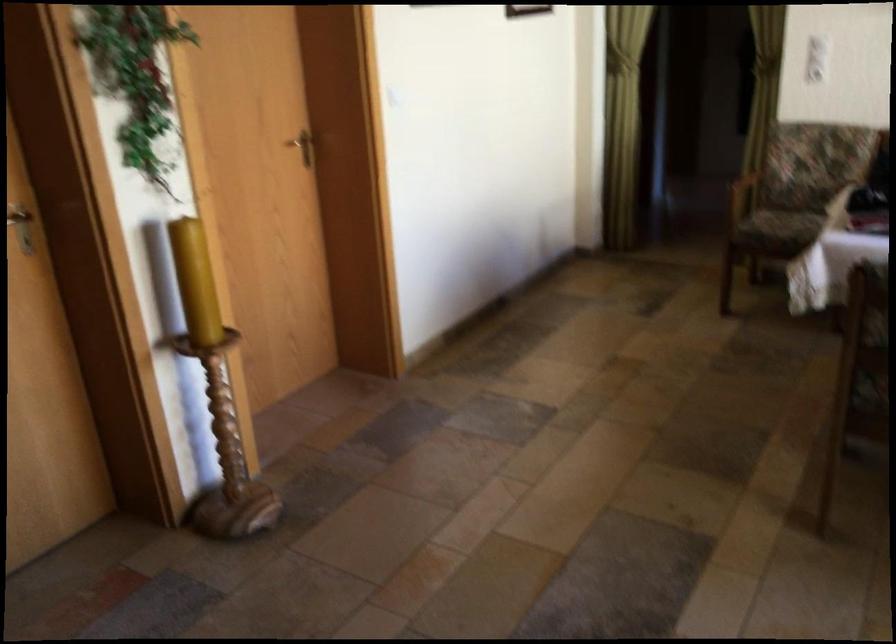
Question: How did the camera likely rotate?

Choices:
 (A) Left
 (B) Right
 (C) Up
 (D) Down

Answer: (B)